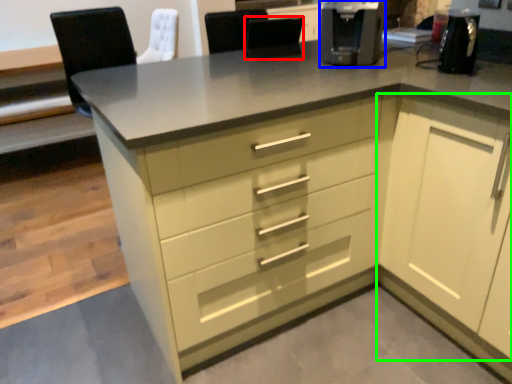
Question: Which is farther away from chair (highlighted by a red box)? coffee machine (highlighted by a blue box) or cabinetry (highlighted by a green box)?

Choices:
 (A) coffee machine
 (B) cabinetry

Answer: (B)